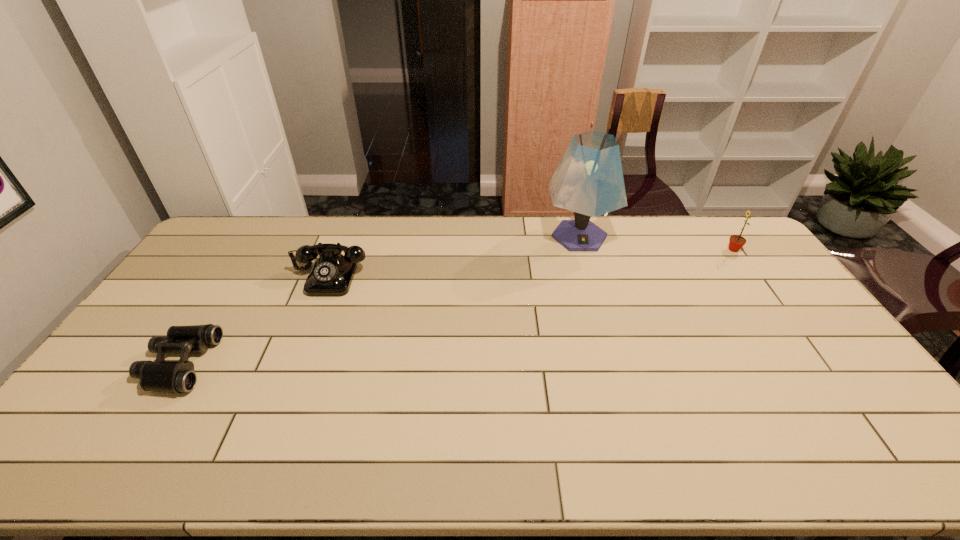
Identify the location of free space at the right edge of the desktop. The image size is (960, 540). (729, 262).

Find the location of a particular element. This screenshot has height=540, width=960. vacant space at the far left corner is located at coordinates (218, 244).

Image resolution: width=960 pixels, height=540 pixels. In order to click on vacant space at the near right corner of the desktop in this screenshot , I will do `click(897, 467)`.

The width and height of the screenshot is (960, 540). In order to click on free space between the second object from right to left and the telephone in this screenshot , I will do `click(454, 256)`.

Locate an element on the screen. empty location between the third tallest object and the leftmost object is located at coordinates (254, 320).

This screenshot has width=960, height=540. Identify the location of unoccupied position between the rightmost object and the shortest object. (456, 307).

You are a GUI agent. You are given a task and a screenshot of the screen. Output one action in this format:
    pyautogui.click(x=<x>, y=<y>)
    Task: Click on the vacant space that's between the second object from right to left and the shortest object
    
    Given the screenshot: What is the action you would take?
    pyautogui.click(x=379, y=300)

Where is `vacant point located between the binoculars and the third tallest object`? The height and width of the screenshot is (540, 960). vacant point located between the binoculars and the third tallest object is located at coordinates (254, 320).

Locate an element on the screen. This screenshot has width=960, height=540. empty space that is in between the tallest object and the third tallest object is located at coordinates (454, 256).

Identify the location of empty space between the telephone and the leftmost object. (254, 320).